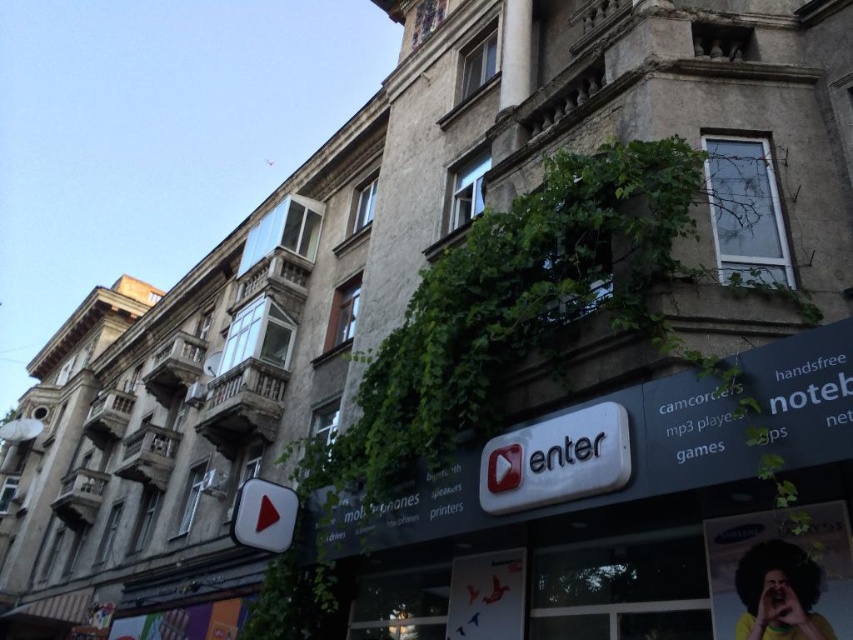
Which is above, white plastic sign at center or shiny red play button at lower left?

white plastic sign at center is higher up.

Does point (508, 444) come closer to viewer compared to point (252, 480)?

Yes, it is.

Where is `white plastic sign at center`? white plastic sign at center is located at coordinates 556,460.

Identify the location of white plastic sign at center. (556, 460).